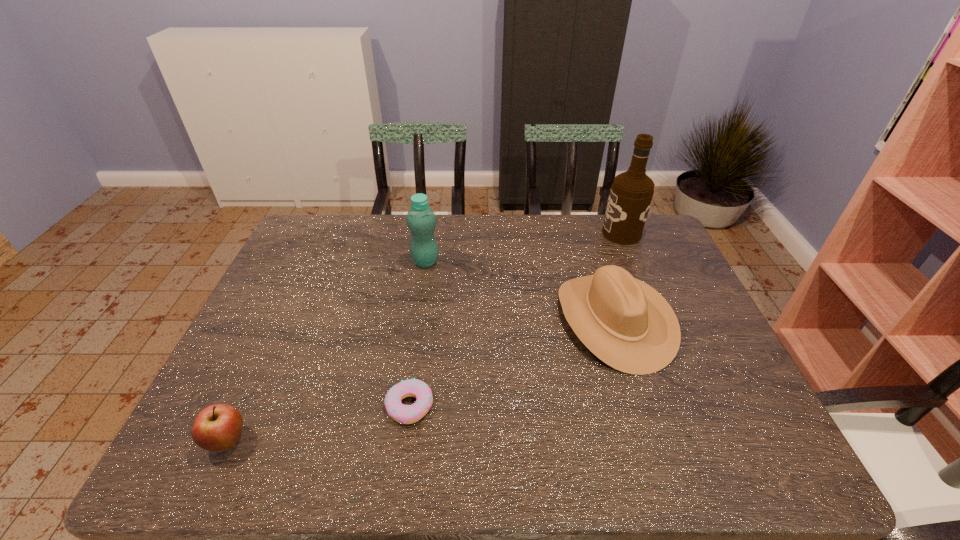
Identify which object is the nearest to the shortest object. Please provide its 2D coordinates. Your answer should be formatted as a tuple, i.e. [(x, y)], where the tuple contains the x and y coordinates of a point satisfying the conditions above.

[(218, 427)]

Identify the location of vacant space that satisfies the following two spatial constraints: 1. on the label of the tallest object; 2. at the front cap of the second farthest object. The image size is (960, 540). (634, 262).

Where is `free region that satisfies the following two spatial constraints: 1. at the front cap of the second farthest object; 2. on the left side of the third nearest object`? free region that satisfies the following two spatial constraints: 1. at the front cap of the second farthest object; 2. on the left side of the third nearest object is located at coordinates (417, 320).